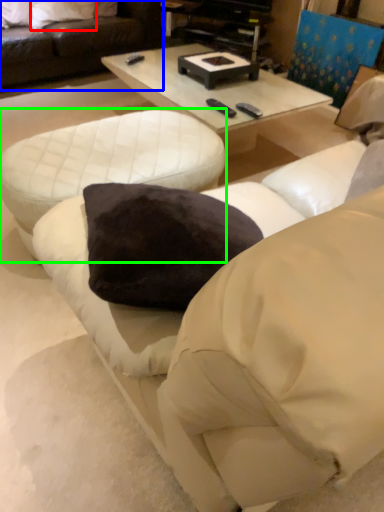
Question: Which object is positioned closest to pillow (highlighted by a red box)? Select from studio couch (highlighted by a blue box) and table (highlighted by a green box).

Choices:
 (A) studio couch
 (B) table

Answer: (A)